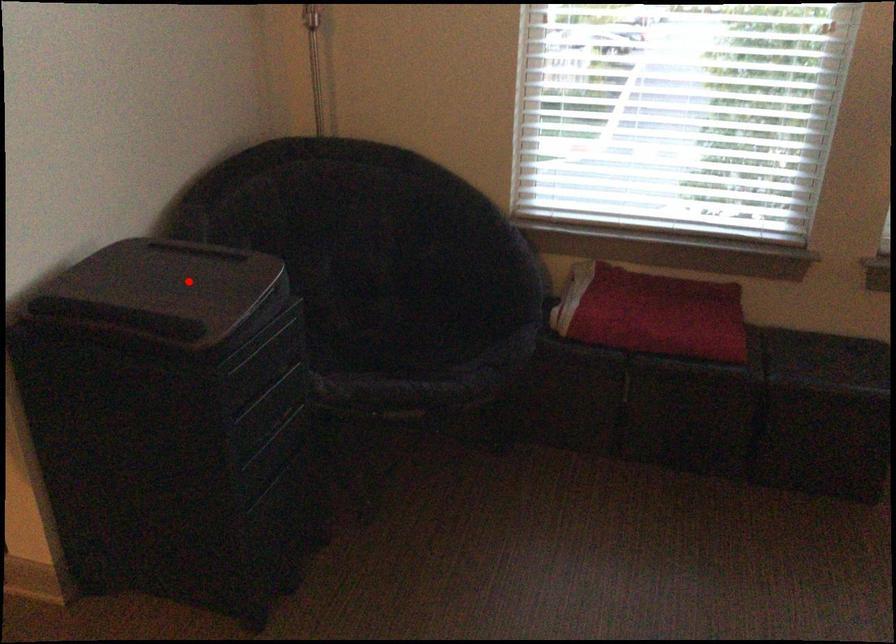
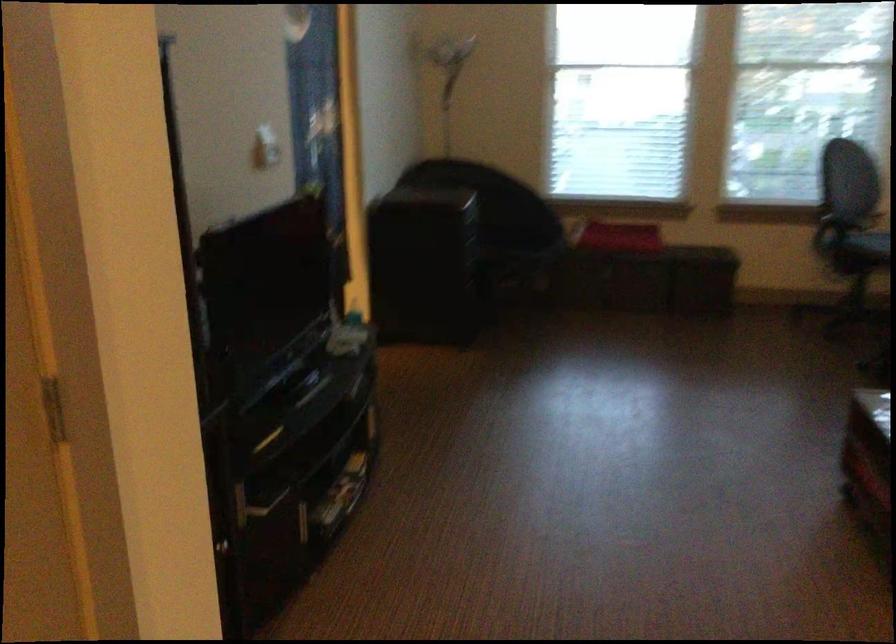
Question: I am providing you with two images of the same scene from different viewpoints. A red point is marked on the first image. Is the red point's position out of view in image 2?

Choices:
 (A) Yes
 (B) No

Answer: (A)